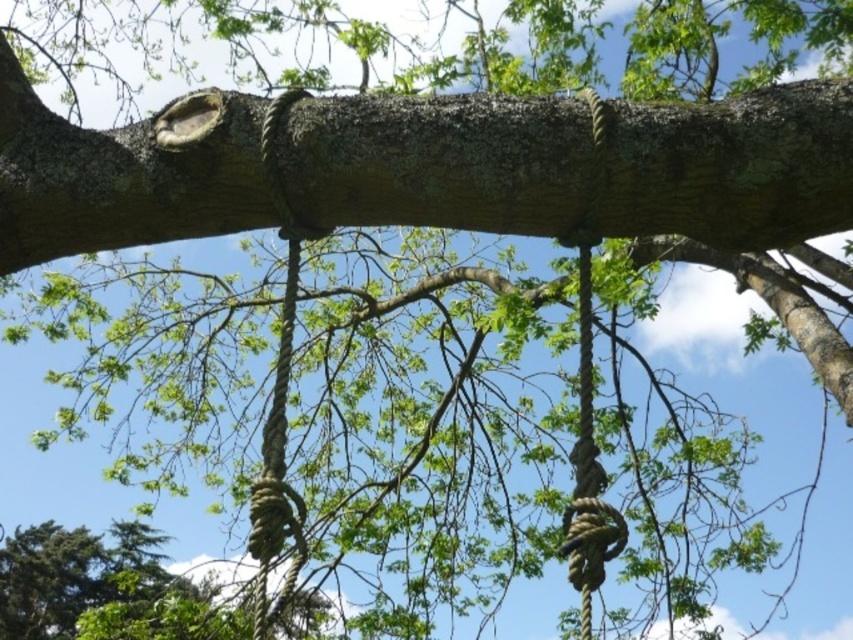
You are a climber assessing the ropes tied to the tree branch. You need to choose the thicker rope for safety. Which rope should you select between the rope at center and the rope at upper center?

The rope at center is thicker than the rope at upper center, so you should select the rope at center for safety.

You are a hiker planning to secure a package to the tree branch using the two ropes shown. The package requires the use of the larger rope to ensure stability. Which rope should you choose between the rope at center and the rope at upper center?

The rope at center is larger in size than the rope at upper center, so you should choose the rope at center to secure the package for stability.